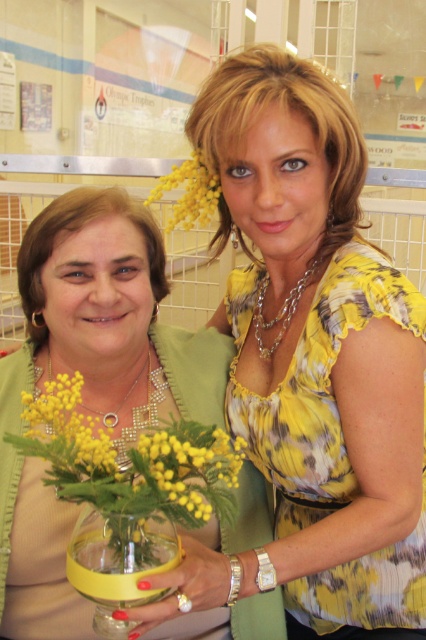
You are at a party and want to take a photo of the matte green dress at center and the yellow matte flowers at center. If you stand facing the scene, which object would be on your right side?

The yellow matte flowers at center are on the right side because the matte green dress at center is to the left of them.

You are a florist arranging a bouquet and need to place the yellow fluffy flower at upper center and yellow matte flowers at center into a vase. The vase has a narrow neck that can only accommodate items spaced 40 centimeters apart. Can both flowers fit into the vase without overlapping?

The distance between the yellow matte flowers at center and yellow fluffy flower at upper center is 45.05 centimeters, which is greater than the 40 centimeter limit of the vase. Therefore, they cannot fit without overlapping.